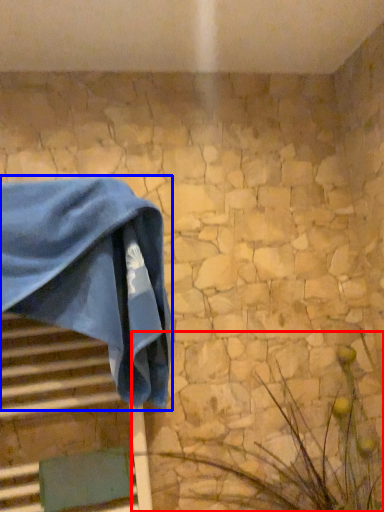
Question: Among these objects, which one is farthest to the camera, plant (highlighted by a red box) or towel (highlighted by a blue box)?

Choices:
 (A) plant
 (B) towel

Answer: (B)